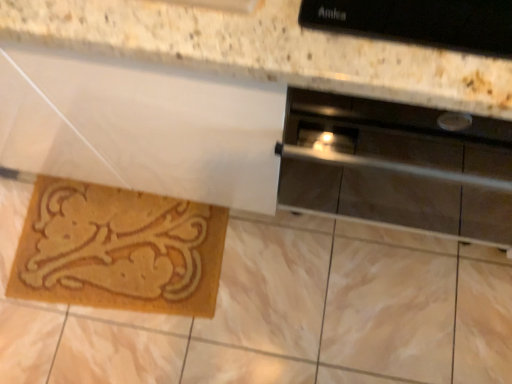
Describe the element at coordinates (397, 166) in the screenshot. I see `stainless steel oven at right` at that location.

Locate an element on the screen. The width and height of the screenshot is (512, 384). stainless steel oven at right is located at coordinates (397, 166).

The image size is (512, 384). I want to click on natural fiber mat at lower left, so click(119, 249).

What do you see at coordinates (119, 249) in the screenshot? I see `natural fiber mat at lower left` at bounding box center [119, 249].

Where is `stainless steel oven at right`? This screenshot has height=384, width=512. stainless steel oven at right is located at coordinates (397, 166).

Can you confirm if natural fiber mat at lower left is positioned to the left of stainless steel oven at right?

Yes.

From the picture: Is natural fiber mat at lower left positioned behind stainless steel oven at right?

Yes, the depth of natural fiber mat at lower left is greater than that of stainless steel oven at right.

Does point (31, 294) come in front of point (485, 131)?

No, it is behind (485, 131).

From the image's perspective, is natural fiber mat at lower left above or below stainless steel oven at right?

From the image's perspective, natural fiber mat at lower left appears below stainless steel oven at right.

From a real-world perspective, is natural fiber mat at lower left positioned above or below stainless steel oven at right?

From a real-world perspective, natural fiber mat at lower left is physically below stainless steel oven at right.

In terms of width, does natural fiber mat at lower left look wider or thinner when compared to stainless steel oven at right?

Clearly, natural fiber mat at lower left has less width compared to stainless steel oven at right.

Considering the relative sizes of natural fiber mat at lower left and stainless steel oven at right in the image provided, is natural fiber mat at lower left shorter than stainless steel oven at right?

Correct, natural fiber mat at lower left is not as tall as stainless steel oven at right.

Based on the photo, based on their sizes in the image, would you say natural fiber mat at lower left is bigger or smaller than stainless steel oven at right?

Clearly, natural fiber mat at lower left is smaller in size than stainless steel oven at right.

Is natural fiber mat at lower left completely or partially outside of stainless steel oven at right?

Indeed, natural fiber mat at lower left is completely outside stainless steel oven at right.

Is natural fiber mat at lower left far away from stainless steel oven at right?

That's not correct — natural fiber mat at lower left is a little close to stainless steel oven at right.

Is natural fiber mat at lower left oriented away from stainless steel oven at right?

No, natural fiber mat at lower left is not facing away from stainless steel oven at right.

Measure the distance from natural fiber mat at lower left to stainless steel oven at right.

A distance of 59.98 centimeters exists between natural fiber mat at lower left and stainless steel oven at right.

Image resolution: width=512 pixels, height=384 pixels. Find the location of `doormat below the stainless steel oven at right (from a real-world perspective)`. doormat below the stainless steel oven at right (from a real-world perspective) is located at coordinates point(119,249).

Is stainless steel oven at right to the left of natural fiber mat at lower left from the viewer's perspective?

Incorrect, stainless steel oven at right is not on the left side of natural fiber mat at lower left.

In the scene shown: Which is in front, stainless steel oven at right or natural fiber mat at lower left?

stainless steel oven at right is in front.

Is point (509, 157) positioned after point (37, 253)?

No.

From the image's perspective, is stainless steel oven at right above or below natural fiber mat at lower left?

stainless steel oven at right is above natural fiber mat at lower left.

From a real-world perspective, is stainless steel oven at right physically located above or below natural fiber mat at lower left?

stainless steel oven at right is above natural fiber mat at lower left.

Does stainless steel oven at right have a lesser width compared to natural fiber mat at lower left?

In fact, stainless steel oven at right might be wider than natural fiber mat at lower left.

Does stainless steel oven at right have a lesser height compared to natural fiber mat at lower left?

No, stainless steel oven at right is not shorter than natural fiber mat at lower left.

Can you confirm if stainless steel oven at right is bigger than natural fiber mat at lower left?

Correct, stainless steel oven at right is larger in size than natural fiber mat at lower left.

Is stainless steel oven at right inside or outside of natural fiber mat at lower left?

stainless steel oven at right is located beyond the bounds of natural fiber mat at lower left.

From the picture: Is stainless steel oven at right with natural fiber mat at lower left?

No, stainless steel oven at right is not making contact with natural fiber mat at lower left.

Is stainless steel oven at right positioned with its back to natural fiber mat at lower left?

No, stainless steel oven at right is not facing away from natural fiber mat at lower left.

Looking at this image, how many degrees apart are the facing directions of stainless steel oven at right and natural fiber mat at lower left?

They differ by 5.32 degrees in their facing directions.

Measure the distance between stainless steel oven at right and natural fiber mat at lower left.

stainless steel oven at right is 59.98 centimeters from natural fiber mat at lower left.

The width and height of the screenshot is (512, 384). Identify the location of home appliance in front of the natural fiber mat at lower left. (397, 166).

You are a GUI agent. You are given a task and a screenshot of the screen. Output one action in this format:
    pyautogui.click(x=<x>, y=<y>)
    Task: Click on the doormat lying below the stainless steel oven at right (from the image's perspective)
    This screenshot has width=512, height=384.
    Given the screenshot: What is the action you would take?
    pyautogui.click(x=119, y=249)

The image size is (512, 384). I want to click on doormat behind the stainless steel oven at right, so click(x=119, y=249).